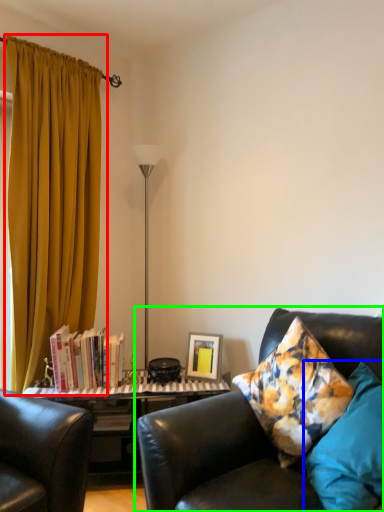
Question: Estimate the real-world distances between objects in this image. Which object is closer to curtain (highlighted by a red box), pillow (highlighted by a blue box) or studio couch (highlighted by a green box)?

Choices:
 (A) pillow
 (B) studio couch

Answer: (B)